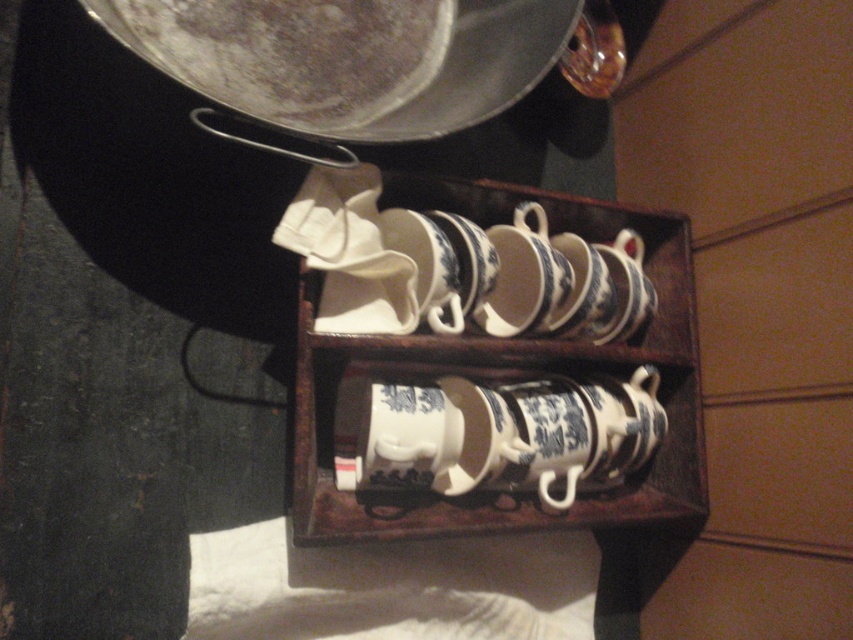
Question: Which point is farther to the camera?

Choices:
 (A) blue and white porcelain cups at center
 (B) shiny silver frying pan at upper center

Answer: (A)

Question: Is shiny silver frying pan at upper center smaller than blue and white porcelain cups at center?

Choices:
 (A) no
 (B) yes

Answer: (B)

Question: Can you confirm if shiny silver frying pan at upper center is thinner than blue and white porcelain cups at center?

Choices:
 (A) no
 (B) yes

Answer: (A)

Question: From the image, what is the correct spatial relationship of shiny silver frying pan at upper center in relation to blue and white porcelain cups at center?

Choices:
 (A) right
 (B) left

Answer: (B)